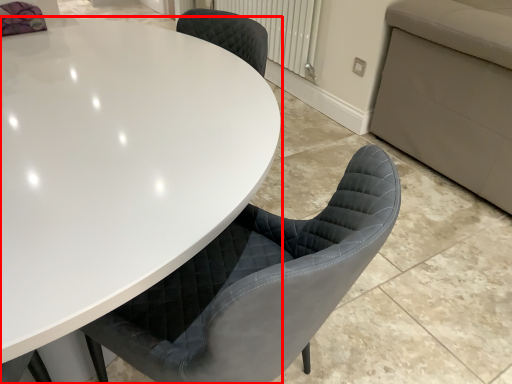
Question: From the image's perspective, considering the relative positions of table (annotated by the red box) and radiator in the image provided, where is table (annotated by the red box) located with respect to the staircase?

Choices:
 (A) below
 (B) above

Answer: (A)